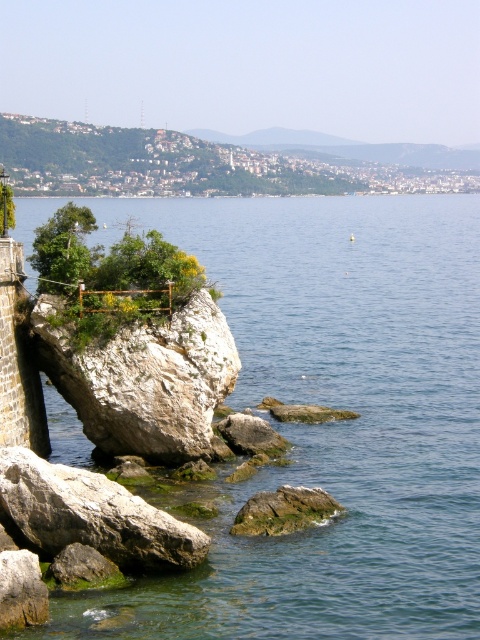
Can you confirm if white rough rock at center is positioned above green mossy rock at lower center?

Indeed, white rough rock at center is positioned over green mossy rock at lower center.

Is white rough rock at center positioned in front of green mossy rock at lower center?

No.

The image size is (480, 640). Describe the element at coordinates (144, 380) in the screenshot. I see `white rough rock at center` at that location.

This screenshot has width=480, height=640. Find the location of `white rough rock at center`. white rough rock at center is located at coordinates (144, 380).

Is clear blue water at center to the left of green mossy rock at lower center from the viewer's perspective?

Yes, clear blue water at center is to the left of green mossy rock at lower center.

Can you confirm if clear blue water at center is positioned to the right of green mossy rock at lower center?

No, clear blue water at center is not to the right of green mossy rock at lower center.

Is point (397, 624) positioned behind point (277, 500)?

No, it is not.

You are a GUI agent. You are given a task and a screenshot of the screen. Output one action in this format:
    pyautogui.click(x=<x>, y=<y>)
    Task: Click on the clear blue water at center
    Image resolution: width=480 pixels, height=640 pixels.
    Given the screenshot: What is the action you would take?
    pyautogui.click(x=333, y=422)

Does point (166, 454) come behind point (143, 506)?

Yes, point (166, 454) is behind point (143, 506).

Does white rough rock at center appear on the right side of gray rough rock at lower left?

Indeed, white rough rock at center is positioned on the right side of gray rough rock at lower left.

You are a GUI agent. You are given a task and a screenshot of the screen. Output one action in this format:
    pyautogui.click(x=<x>, y=<y>)
    Task: Click on the white rough rock at center
    The image size is (480, 640).
    Given the screenshot: What is the action you would take?
    pyautogui.click(x=144, y=380)

Where is `white rough rock at center`? The height and width of the screenshot is (640, 480). white rough rock at center is located at coordinates (144, 380).